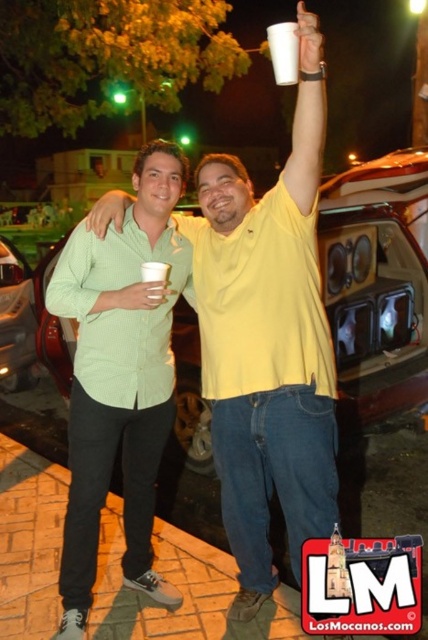
Question: Which object is the closest to the metallic silver car at left?

Choices:
 (A) green matte shirt at center
 (B) metallic silver car at center
 (C) white paper cup at upper center

Answer: (A)

Question: Observing the image, what is the correct spatial positioning of green matte shirt at center in reference to white paper cup at upper center?

Choices:
 (A) below
 (B) above

Answer: (A)

Question: Which of the following is the closest to the observer?

Choices:
 (A) (88, 282)
 (B) (297, 76)
 (C) (17, 337)

Answer: (B)

Question: Can you confirm if green matte shirt at center is positioned to the right of metallic silver car at left?

Choices:
 (A) no
 (B) yes

Answer: (B)

Question: Can you confirm if metallic silver car at center is positioned below white paper cup at upper center?

Choices:
 (A) yes
 (B) no

Answer: (A)

Question: Which point is closer to the camera taking this photo?

Choices:
 (A) (279, 83)
 (B) (190, 449)
 (C) (14, 250)
 (D) (172, 176)

Answer: (A)